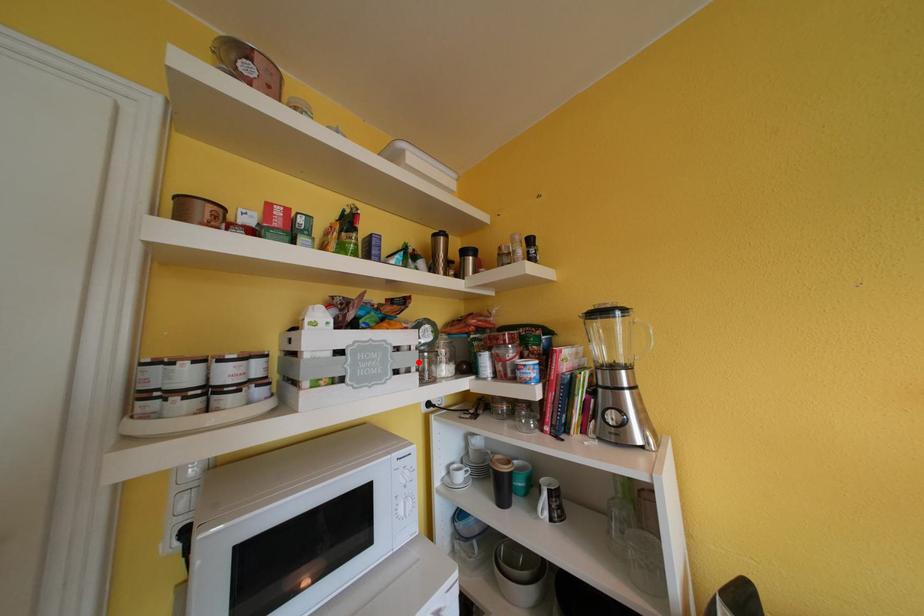
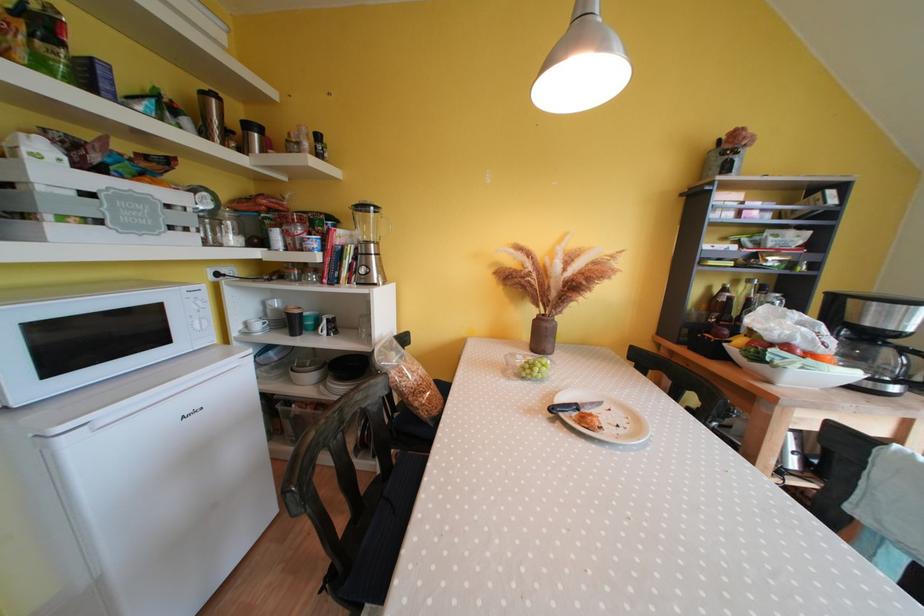
In the second image, find the point that corresponds to the highlighted location in the first image.

(196, 224)